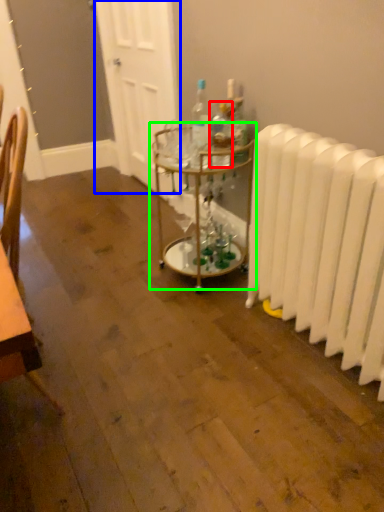
Question: Which is farther away from bottle (highlighted by a red box)? door (highlighted by a blue box) or table (highlighted by a green box)?

Choices:
 (A) door
 (B) table

Answer: (A)